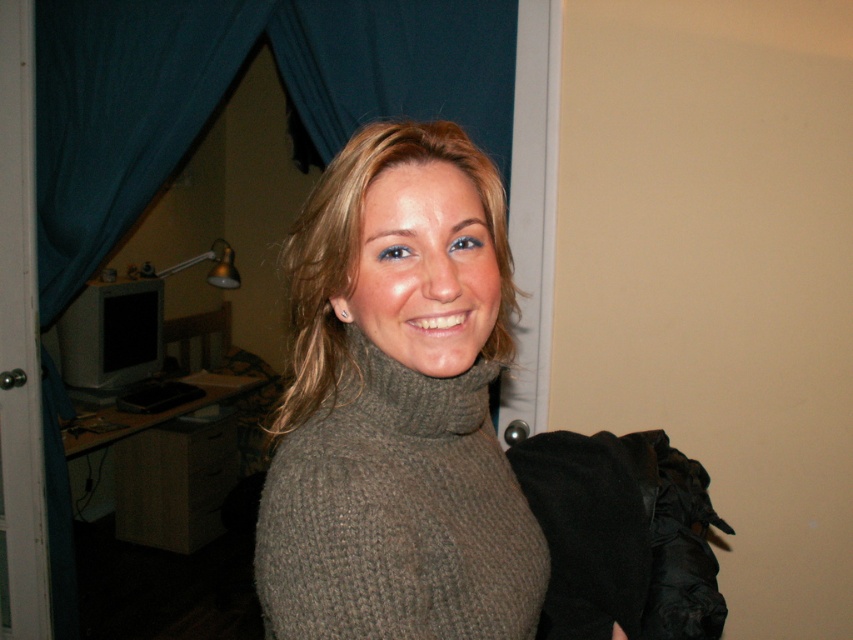
You are a fashion designer analyzing the clothing items in the image. You need to determine which clothing item is wider between the knit sweater at center and the knitted gray polo neck at center. Which one is wider?

The knit sweater at center is wider than the knitted gray polo neck at center according to the description.

You are standing in the room and want to locate the point at coordinate (225, 90). Where exactly would you find this point in relation to the blue fabric curtain at upper left?

The point at coordinate (225, 90) is located on the blue fabric curtain at upper left.

You are a photographer setting up a shoot in this room. You want to position a light source between the blue fabric curtain at upper left and the knitted gray polo neck at center. How far apart should you place the light source from each object?

The blue fabric curtain at upper left and knitted gray polo neck at center are 5.17 feet apart from each other. To position the light source exactly in the middle, it should be placed 2.585 feet away from each object.